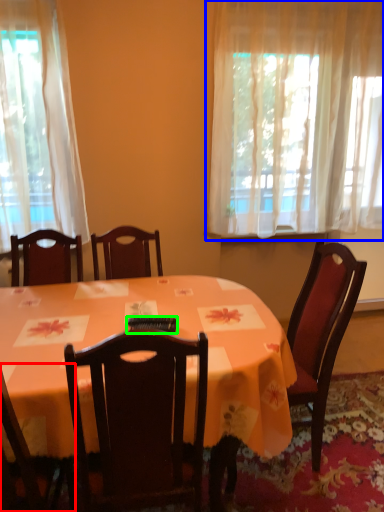
Question: Which object is the farthest from chair (highlighted by a red box)? Choose among these: curtain (highlighted by a blue box) or remote control (highlighted by a green box).

Choices:
 (A) curtain
 (B) remote control

Answer: (A)